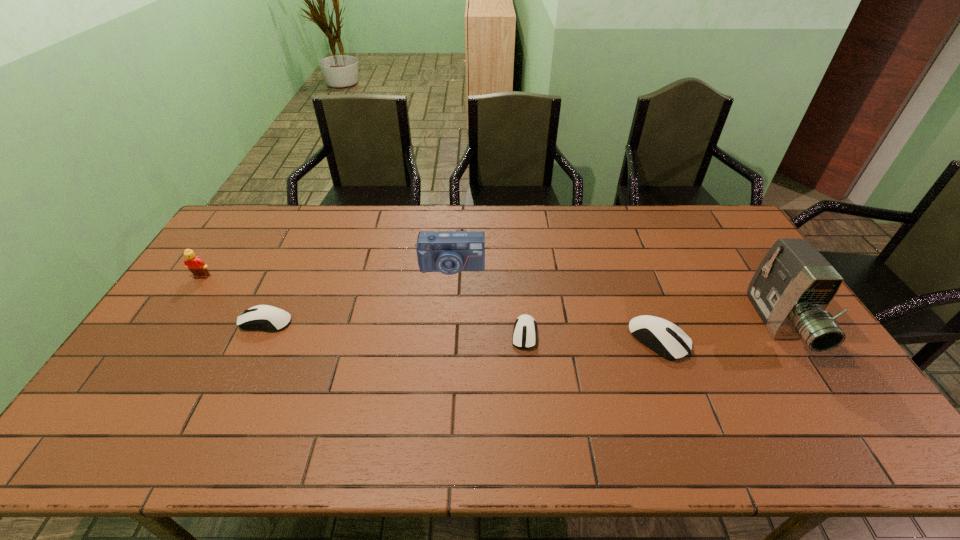
This screenshot has height=540, width=960. Find the location of `the fifth tallest object`. the fifth tallest object is located at coordinates (261, 317).

At what (x,y) coordinates should I click in order to perform the action: click on the second tallest mouse. Please return your answer as a coordinate pair (x, y). The image size is (960, 540). Looking at the image, I should click on (261, 317).

I want to click on the shortest object, so click(524, 332).

Find the location of a particular element. The image size is (960, 540). the fourth object from left to right is located at coordinates (524, 332).

Where is `the fifth object from left to right`? the fifth object from left to right is located at coordinates (662, 336).

This screenshot has width=960, height=540. Find the location of `the fourth shortest object`. the fourth shortest object is located at coordinates (197, 266).

Find the location of `the leftmost object`. the leftmost object is located at coordinates (197, 266).

Identify the location of the third object from left to right. (449, 252).

Find the location of a particular element. This screenshot has width=960, height=540. the tallest object is located at coordinates (793, 285).

Identify the location of camcorder. This screenshot has width=960, height=540. (793, 285).